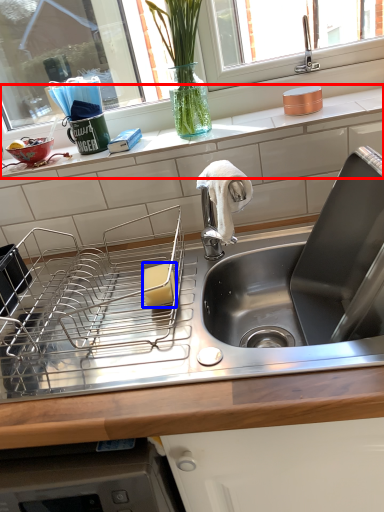
Question: Which object appears farthest to the camera in this image, countertop (highlighted by a red box) or food (highlighted by a blue box)?

Choices:
 (A) countertop
 (B) food

Answer: (A)